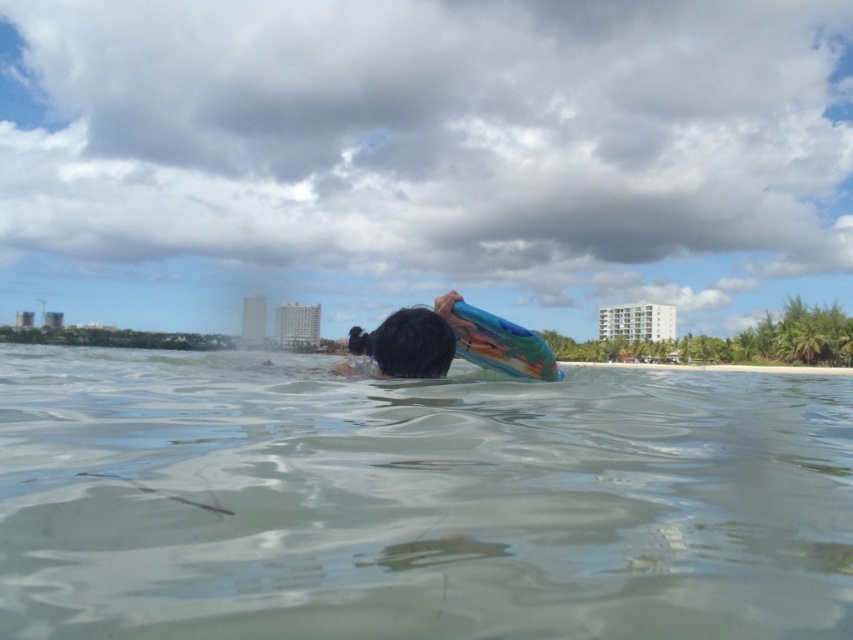
Question: Which of the following is the farthest from the observer?

Choices:
 (A) (695, 428)
 (B) (426, 371)

Answer: (B)

Question: Which object is closer to the camera taking this photo?

Choices:
 (A) smooth blue surfboard at center
 (B) clear water at center

Answer: (B)

Question: Does clear water at center appear on the left side of smooth blue surfboard at center?

Choices:
 (A) no
 (B) yes

Answer: (B)

Question: Which of the following is the farthest from the observer?

Choices:
 (A) (479, 605)
 (B) (361, 372)

Answer: (B)

Question: Is clear water at center bigger than smooth blue surfboard at center?

Choices:
 (A) no
 (B) yes

Answer: (B)

Question: Does clear water at center appear over smooth blue surfboard at center?

Choices:
 (A) yes
 (B) no

Answer: (B)